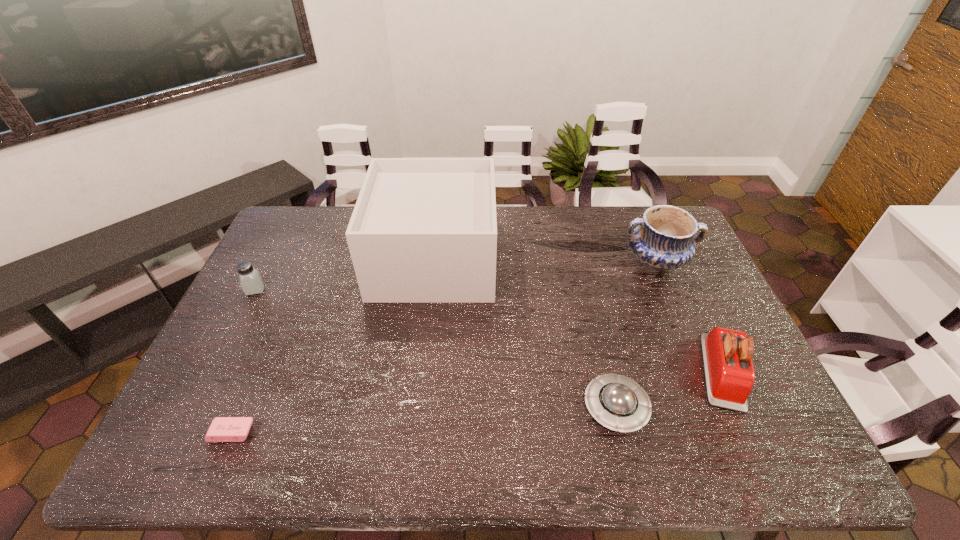
You are a GUI agent. You are given a task and a screenshot of the screen. Output one action in this format:
    pyautogui.click(x=<x>, y=<y>)
    Task: Click on the empty space that is in between the box and the pottery
    The image size is (960, 540).
    Given the screenshot: What is the action you would take?
    pyautogui.click(x=545, y=260)

The image size is (960, 540). Identify the location of blank region between the saucer and the second tallest object. (636, 334).

Select which object appears as the third closest to the box. Please provide its 2D coordinates. Your answer should be formatted as a tuple, i.e. [(x, y)], where the tuple contains the x and y coordinates of a point satisfying the conditions above.

[(663, 240)]

This screenshot has width=960, height=540. In order to click on object that is the second nearest to the leftmost object in this screenshot , I will do point(222,429).

I want to click on vacant region that satisfies the following two spatial constraints: 1. on the back side of the fifth object from right to left; 2. on the right side of the pottery, so click(x=305, y=261).

What are the coordinates of `free space that satisfies the following two spatial constraints: 1. on the side of the second shortest object with the window; 2. on the right side of the fourth object from right to left` in the screenshot? It's located at (418, 407).

Where is `vacant space that satisfies the following two spatial constraints: 1. on the back side of the saucer; 2. on the side of the third object from left to right with the window`? This screenshot has height=540, width=960. vacant space that satisfies the following two spatial constraints: 1. on the back side of the saucer; 2. on the side of the third object from left to right with the window is located at coordinates (580, 259).

Where is `free space that satisfies the following two spatial constraints: 1. on the back side of the toaster; 2. on the left side of the saucer`? The image size is (960, 540). free space that satisfies the following two spatial constraints: 1. on the back side of the toaster; 2. on the left side of the saucer is located at coordinates (607, 372).

Identify the location of free space in the image that satisfies the following two spatial constraints: 1. on the front side of the fourth tallest object; 2. on the right side of the saucer. This screenshot has height=540, width=960. tap(195, 407).

Find the location of a particular element. The width and height of the screenshot is (960, 540). free space that satisfies the following two spatial constraints: 1. on the side of the fourth shortest object with the window; 2. on the right side of the third object from left to right is located at coordinates (421, 372).